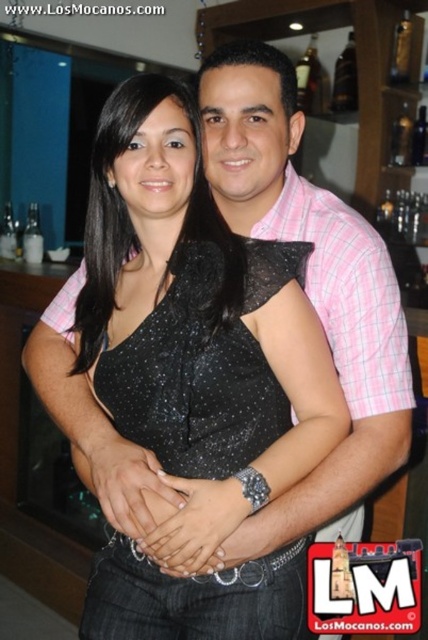
Question: Which object is the closest to the dark brown glass bottle at upper center?

Choices:
 (A) shiny glass bottle at upper right
 (B) black sequined dress at center

Answer: (A)

Question: Is dark brown glass bottle at upper center smaller than shiny glass bottle at upper right?

Choices:
 (A) yes
 (B) no

Answer: (B)

Question: Is the position of black sequined dress at center less distant than that of shiny glass bottle at upper right?

Choices:
 (A) no
 (B) yes

Answer: (B)

Question: Does black sequined dress at center have a lesser width compared to dark brown glass bottle at upper center?

Choices:
 (A) no
 (B) yes

Answer: (A)

Question: Which point is closer to the camera?

Choices:
 (A) dark brown glass bottle at upper center
 (B) black sequined dress at center
 (C) shiny glass bottle at upper right

Answer: (B)

Question: Which of the following is the closest to the observer?

Choices:
 (A) shiny glass bottle at upper right
 (B) dark brown glass bottle at upper center

Answer: (A)